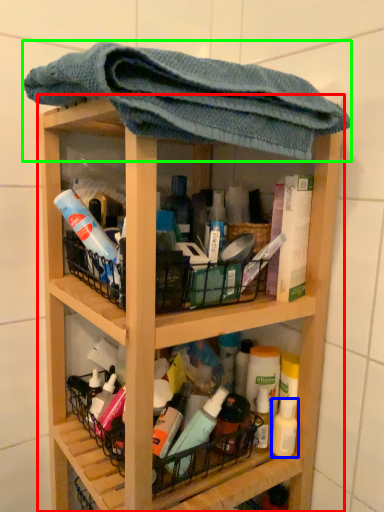
Question: Based on their relative distances, which object is nearer to shelf (highlighted by a red box)? Choose from mouthwash (highlighted by a blue box) and towel (highlighted by a green box).

Choices:
 (A) mouthwash
 (B) towel

Answer: (B)